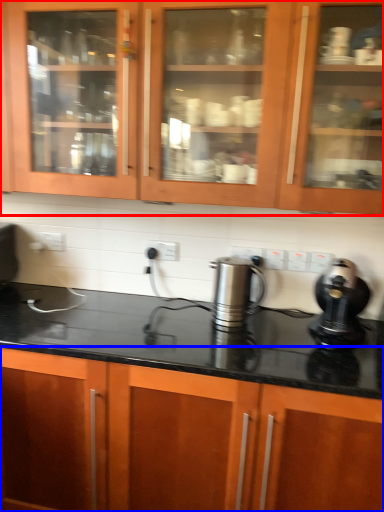
Question: Among these objects, which one is nearest to the camera, cabinetry (highlighted by a red box) or cabinetry (highlighted by a blue box)?

Choices:
 (A) cabinetry
 (B) cabinetry

Answer: (B)